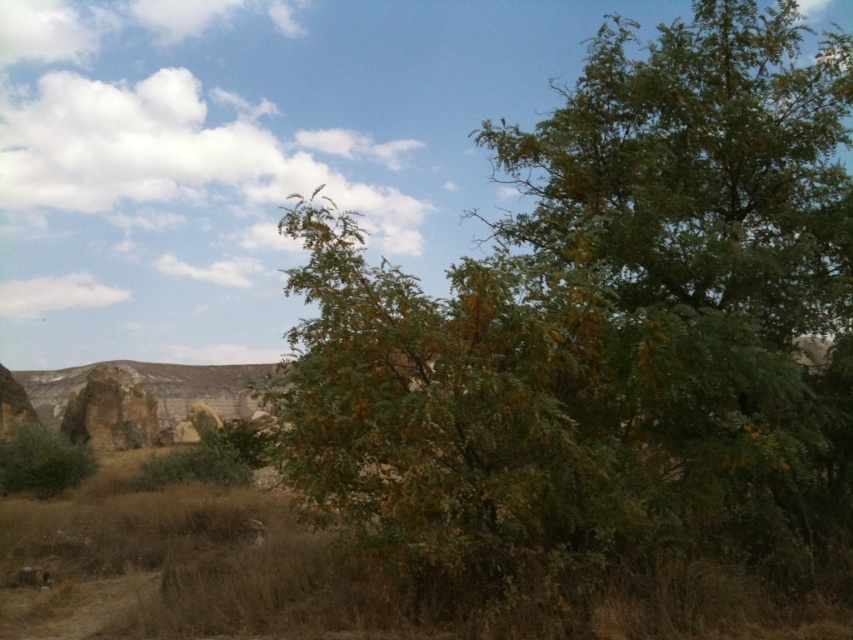
Can you confirm if brown dirt track at lower left is thinner than green leafy bush at lower left?

No.

Based on the photo, can you confirm if brown dirt track at lower left is positioned to the left of green leafy bush at lower left?

Incorrect, brown dirt track at lower left is not on the left side of green leafy bush at lower left.

In order to click on brown dirt track at lower left in this screenshot , I will do (71, 605).

The height and width of the screenshot is (640, 853). I want to click on brown dirt track at lower left, so click(71, 605).

Is brown dirt track at lower left shorter than rustic stone rock formation at left?

Correct, brown dirt track at lower left is not as tall as rustic stone rock formation at left.

Does point (44, 620) come closer to viewer compared to point (143, 422)?

Yes, point (44, 620) is closer to viewer.

Image resolution: width=853 pixels, height=640 pixels. Find the location of `brown dirt track at lower left`. brown dirt track at lower left is located at coordinates (71, 605).

Can you confirm if rustic stone rock formation at left is wider than green leafy bush at lower left?

Yes.

In the scene shown: Does rustic stone rock formation at left have a greater height compared to green leafy bush at lower left?

Indeed, rustic stone rock formation at left has a greater height compared to green leafy bush at lower left.

Find the location of a particular element. rustic stone rock formation at left is located at coordinates (x=109, y=412).

Identify the location of rustic stone rock formation at left. [x=109, y=412].